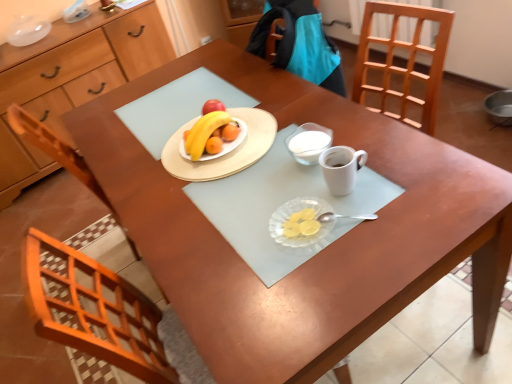
Find the location of a particular element. This screenshot has width=512, height=384. free space to the right of matte wooden plate at center is located at coordinates (313, 113).